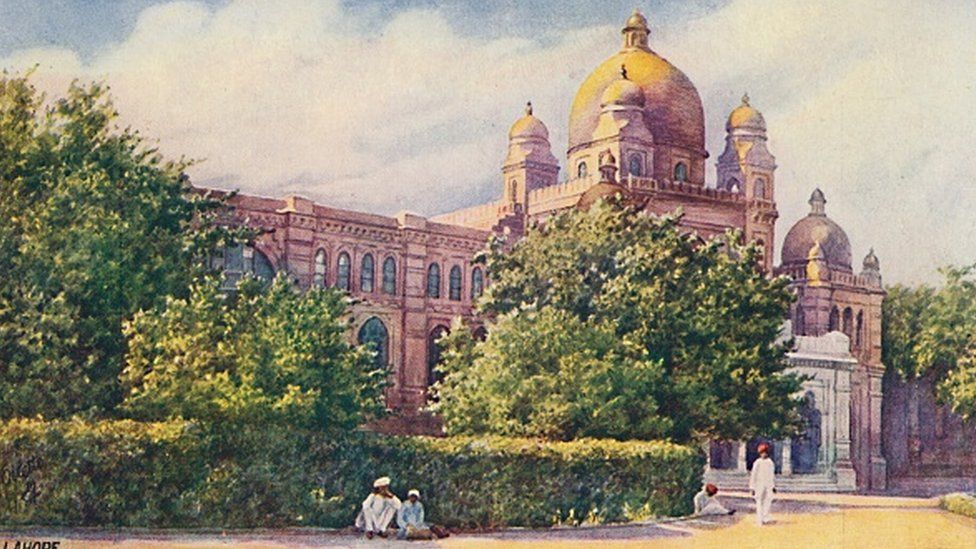
Find the location of a particular element. windows is located at coordinates (388, 282), (373, 278), (346, 273), (324, 267), (427, 270), (446, 277), (461, 277).